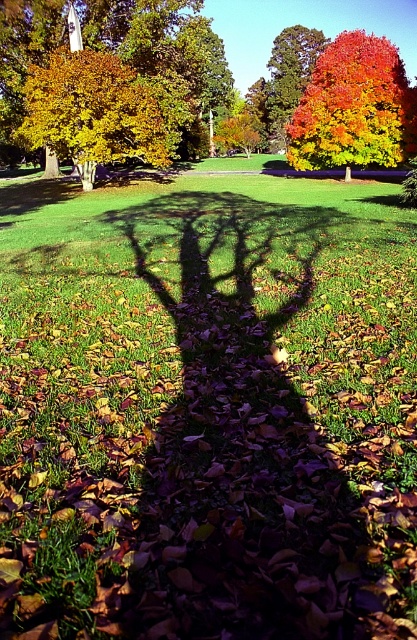
Question: Based on their relative distances, which object is farther from the vivid orange maple at upper right?

Choices:
 (A) golden yellow leaves at upper left
 (B) orange autumn leaves at center

Answer: (A)

Question: Is orange autumn leaves at center thinner than vivid orange maple at upper right?

Choices:
 (A) no
 (B) yes

Answer: (A)

Question: Considering the relative positions of vivid orange maple at upper right and golden yellow leaves at upper left in the image provided, where is vivid orange maple at upper right located with respect to golden yellow leaves at upper left?

Choices:
 (A) above
 (B) below

Answer: (A)

Question: Which of these objects is positioned farthest from the vivid orange maple at upper right?

Choices:
 (A) orange autumn leaves at center
 (B) golden yellow leaves at upper left

Answer: (B)

Question: Which object appears closest to the camera in this image?

Choices:
 (A) vivid orange maple at upper right
 (B) orange autumn leaves at center
 (C) golden yellow leaves at upper left

Answer: (C)

Question: Is orange autumn leaves at center to the right of golden yellow leaves at upper left from the viewer's perspective?

Choices:
 (A) yes
 (B) no

Answer: (A)